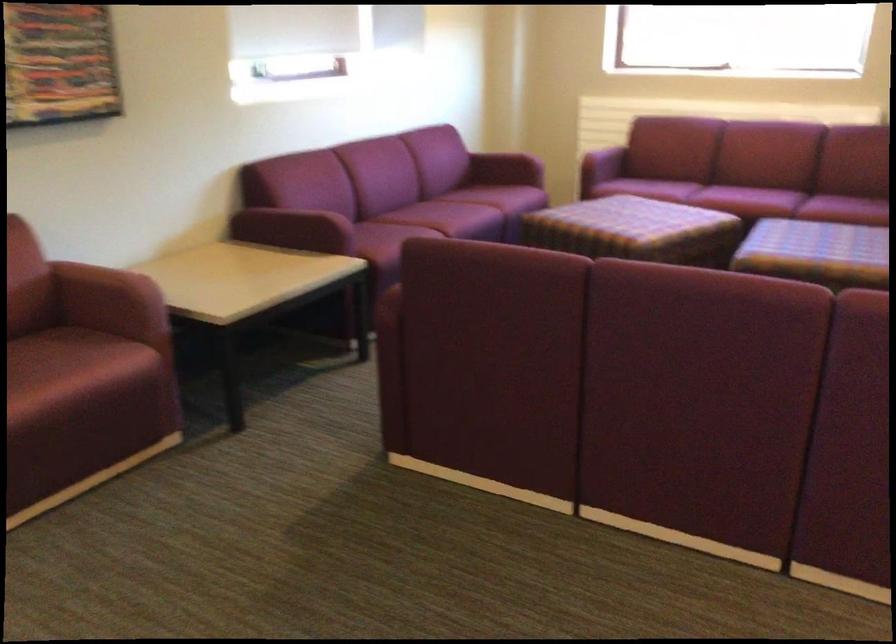
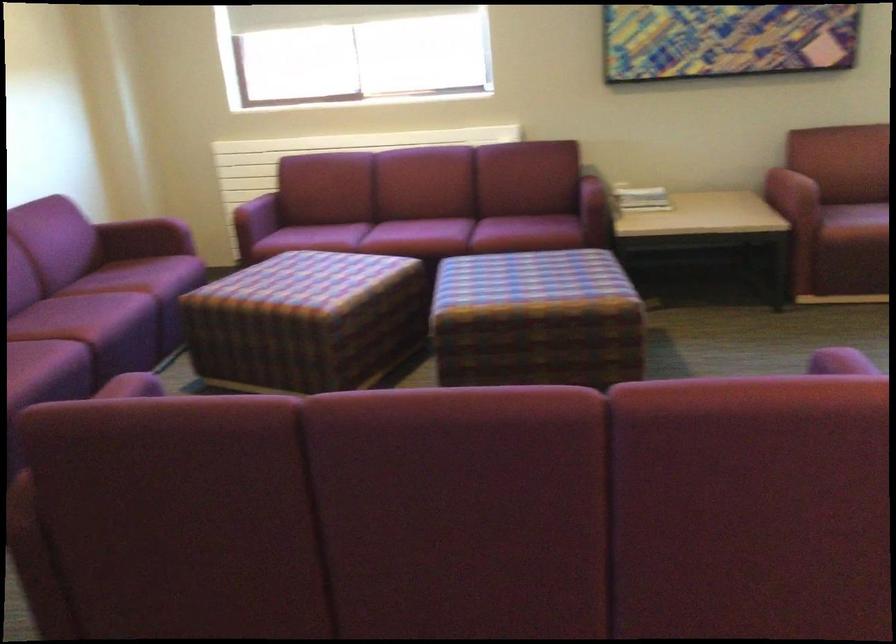
Question: In a continuous first-person perspective shot, in which direction is the camera moving?

Choices:
 (A) Left
 (B) Right
 (C) Forward
 (D) Backward

Answer: (C)